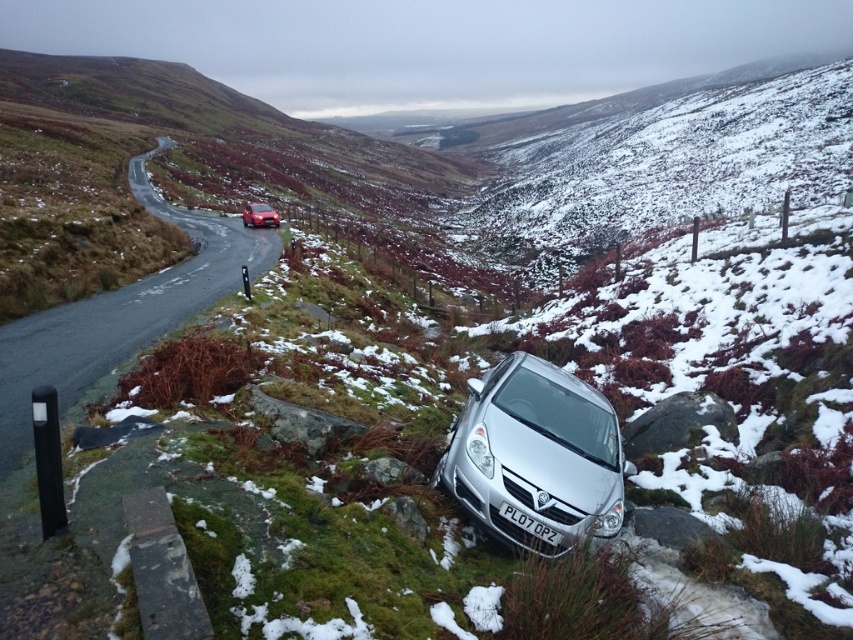
Question: Which point is farther from the camera taking this photo?

Choices:
 (A) (509, 355)
 (B) (253, 212)
 (C) (511, 522)

Answer: (B)

Question: Which object is the closest to the silver metallic license plate at lower center?

Choices:
 (A) metallic red car at center
 (B) smooth asphalt road at upper left

Answer: (B)

Question: Which object appears closest to the camera in this image?

Choices:
 (A) smooth asphalt road at upper left
 (B) silver metallic car at lower center
 (C) metallic red car at center

Answer: (B)

Question: Does silver metallic license plate at lower center have a greater width compared to metallic red car at center?

Choices:
 (A) no
 (B) yes

Answer: (A)

Question: Considering the relative positions of silver metallic car at lower center and metallic red car at center in the image provided, where is silver metallic car at lower center located with respect to metallic red car at center?

Choices:
 (A) right
 (B) left

Answer: (A)

Question: Can you confirm if smooth asphalt road at upper left is thinner than silver metallic license plate at lower center?

Choices:
 (A) yes
 (B) no

Answer: (B)